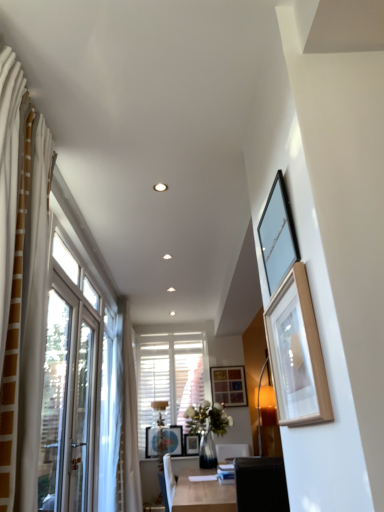
Question: Is wooden picture frame at center, placed as the first picture frame when sorted from bottom to top, bigger or smaller than wooden picture frame at upper right, acting as the second picture frame starting from the top?

Choices:
 (A) big
 (B) small

Answer: (B)

Question: Choose the correct answer: Is wooden picture frame at center, the second picture frame viewed from the left, inside wooden picture frame at upper right, acting as the second picture frame starting from the top, or outside it?

Choices:
 (A) outside
 (B) inside

Answer: (A)

Question: Which of these objects is positioned farthest from the matte black picture frame at upper right, the fourth picture frame positioned from the back?

Choices:
 (A) wooden picture frame at center, marked as the first picture frame in a right-to-left arrangement
 (B) wooden picture frame at center, the second picture frame viewed from the left
 (C) wooden picture frame at center, which ranks as the 5th picture frame in right-to-left order
 (D) wooden picture frame at upper right, the 4th picture frame when ordered from bottom to top
 (E) light wood table at center

Answer: (A)

Question: Which object is positioned farthest from the matte black picture frame at upper right, the 5th picture frame ordered from the bottom?

Choices:
 (A) wooden picture frame at upper right, acting as the second picture frame starting from the top
 (B) wooden picture frame at center, which ranks as the 5th picture frame in right-to-left order
 (C) wooden picture frame at center, the second picture frame viewed from the left
 (D) light wood table at center
 (E) wooden picture frame at center, the first picture frame from the back

Answer: (E)